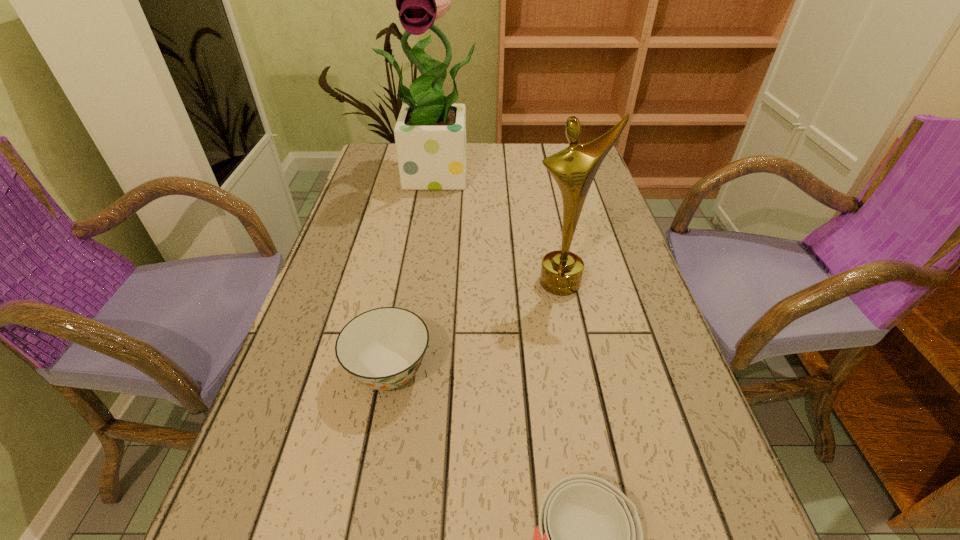
Identify the location of the third closest object to the shorter soup bowl. The image size is (960, 540). (430, 133).